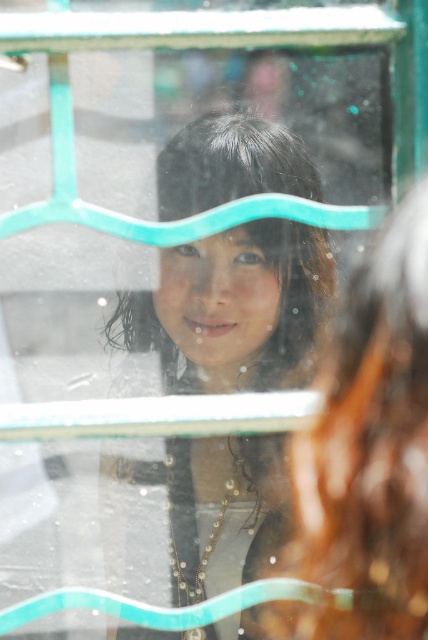
Which of these two, smooth black hair at center or smooth brown hair at upper center, stands taller?

smooth black hair at center is taller.

Measure the distance between smooth black hair at center and camera.

smooth black hair at center is 1.29 meters from camera.

Image resolution: width=428 pixels, height=640 pixels. Describe the element at coordinates (234, 308) in the screenshot. I see `smooth black hair at center` at that location.

Identify the location of smooth black hair at center. (234, 308).